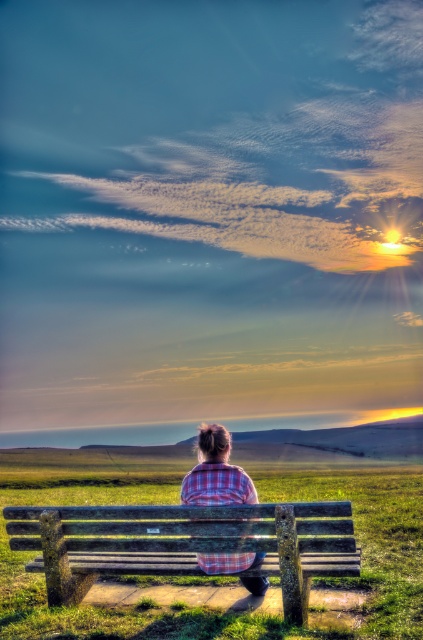
Question: Is wooden bench at center wider than plaid fabric shirt at center?

Choices:
 (A) no
 (B) yes

Answer: (B)

Question: Which point is closer to the camera?

Choices:
 (A) plaid fabric shirt at center
 (B) wooden bench at center

Answer: (B)

Question: Does wooden bench at center appear over plaid fabric shirt at center?

Choices:
 (A) no
 (B) yes

Answer: (A)

Question: Is wooden bench at center below plaid fabric shirt at center?

Choices:
 (A) yes
 (B) no

Answer: (A)

Question: Which point appears closest to the camera in this image?

Choices:
 (A) (302, 536)
 (B) (200, 552)

Answer: (A)